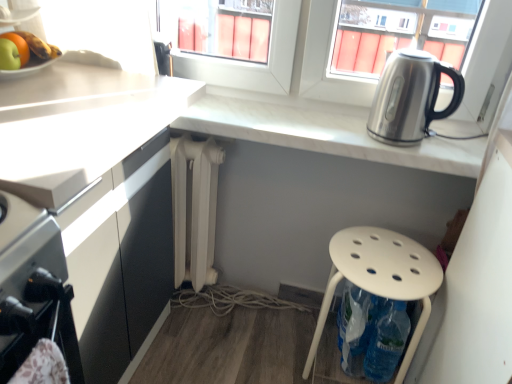
Question: Can you confirm if green matte apple at upper left is thinner than white matte radiator at center?

Choices:
 (A) no
 (B) yes

Answer: (B)

Question: Is green matte apple at upper left not within white matte radiator at center?

Choices:
 (A) no
 (B) yes

Answer: (B)

Question: Is green matte apple at upper left positioned behind white matte radiator at center?

Choices:
 (A) yes
 (B) no

Answer: (B)

Question: Is green matte apple at upper left at the left side of white matte radiator at center?

Choices:
 (A) yes
 (B) no

Answer: (A)

Question: Can you confirm if green matte apple at upper left is shorter than white matte radiator at center?

Choices:
 (A) no
 (B) yes

Answer: (B)

Question: Considering the positions of white marble countertop at upper right, the 1th countertop in the right-to-left sequence, and stainless steel kettle at upper right in the image, is white marble countertop at upper right, the 1th countertop in the right-to-left sequence, bigger or smaller than stainless steel kettle at upper right?

Choices:
 (A) small
 (B) big

Answer: (B)

Question: Is point (404, 165) positioned closer to the camera than point (376, 132)?

Choices:
 (A) farther
 (B) closer

Answer: (A)

Question: Is white marble countertop at upper right, the 1th countertop in the right-to-left sequence, taller or shorter than stainless steel kettle at upper right?

Choices:
 (A) tall
 (B) short

Answer: (B)

Question: From a real-world perspective, is white marble countertop at upper right, marked as the 2th countertop in a left-to-right arrangement, above or below stainless steel kettle at upper right?

Choices:
 (A) below
 (B) above

Answer: (A)

Question: Is white plastic stool at lower right inside or outside of white matte countertop at left, the 2th countertop when ordered from right to left?

Choices:
 (A) inside
 (B) outside

Answer: (B)

Question: From the image's perspective, is white plastic stool at lower right above or below white matte countertop at left, the 2th countertop when ordered from right to left?

Choices:
 (A) below
 (B) above

Answer: (A)

Question: In terms of size, does white plastic stool at lower right appear bigger or smaller than white matte countertop at left, the 2th countertop when ordered from right to left?

Choices:
 (A) small
 (B) big

Answer: (A)

Question: From a real-world perspective, is white plastic stool at lower right above or below white matte countertop at left, which is the 1th countertop in left-to-right order?

Choices:
 (A) below
 (B) above

Answer: (A)

Question: From the image's perspective, relative to white matte radiator at center, is green matte apple at upper left above or below?

Choices:
 (A) above
 (B) below

Answer: (A)

Question: From a real-world perspective, relative to white matte radiator at center, is green matte apple at upper left vertically above or below?

Choices:
 (A) below
 (B) above

Answer: (B)